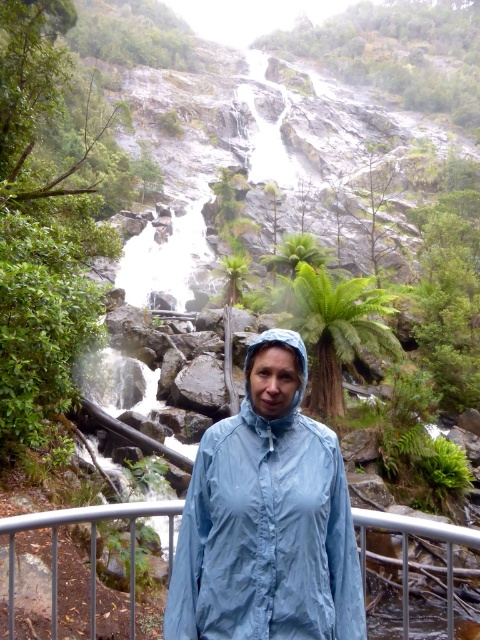
Question: Does light blue nylon jacket at center appear under metallic gray rail at lower center?

Choices:
 (A) no
 (B) yes

Answer: (A)

Question: Can you confirm if light blue nylon jacket at center is wider than metallic gray rail at lower center?

Choices:
 (A) yes
 (B) no

Answer: (A)

Question: Which object appears farthest from the camera in this image?

Choices:
 (A) metallic gray rail at lower center
 (B) light blue nylon jacket at center

Answer: (A)

Question: Which object is closer to the camera taking this photo?

Choices:
 (A) metallic gray rail at lower center
 (B) light blue nylon jacket at center

Answer: (B)

Question: Observing the image, what is the correct spatial positioning of light blue nylon jacket at center in reference to metallic gray rail at lower center?

Choices:
 (A) below
 (B) above

Answer: (B)